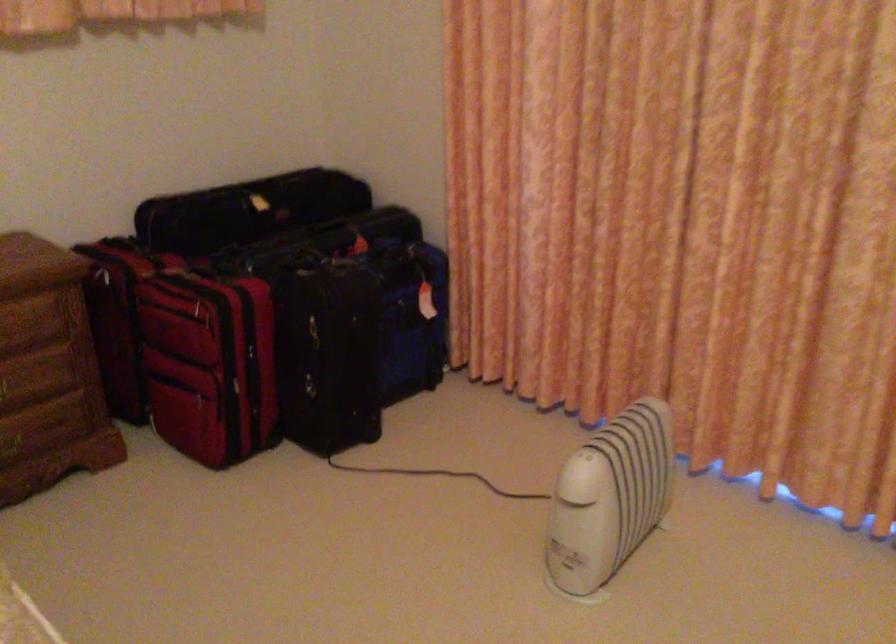
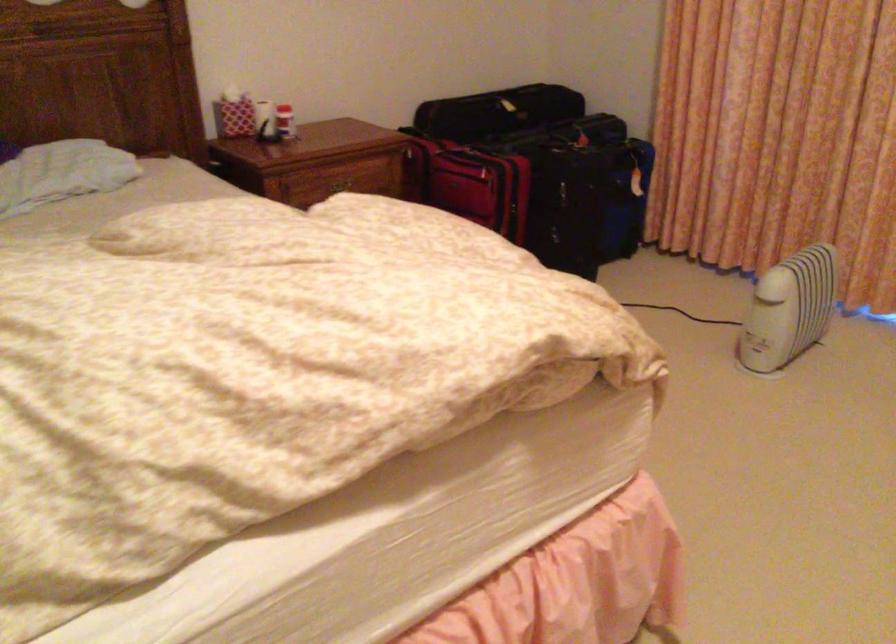
Question: I am providing you with two images of the same scene from different viewpoints. Please identify which objects are invisible in image2.

Choices:
 (A) black suitcase handle
 (B) silver CD disc
 (C) wooden drawer handle
 (D) red and white bottle

Answer: (C)